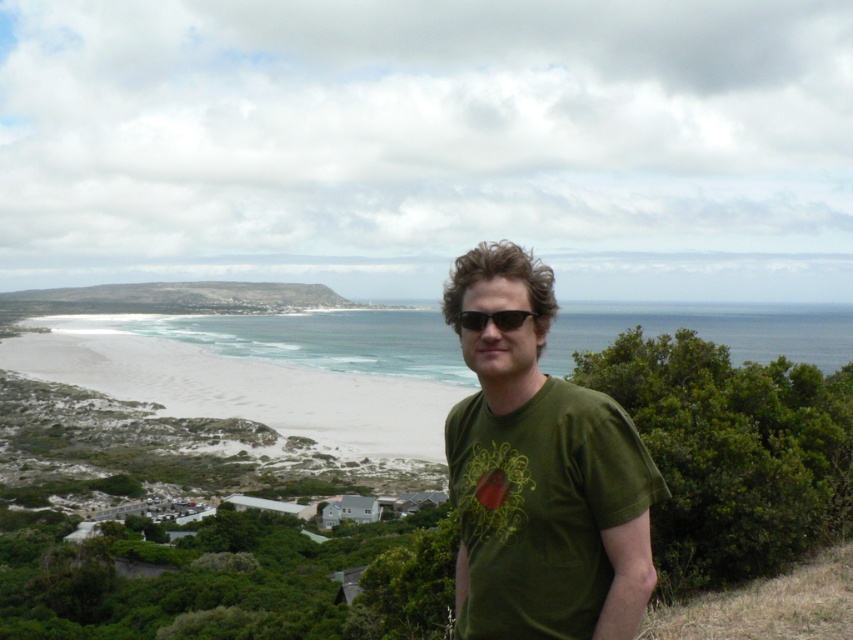
Can you confirm if green matte t-shirt at center is positioned to the left of green grassy hillside at center?

No, green matte t-shirt at center is not to the left of green grassy hillside at center.

Can you confirm if green matte t-shirt at center is wider than green grassy hillside at center?

No, green matte t-shirt at center is not wider than green grassy hillside at center.

Is point (525, 406) positioned in front of point (212, 298)?

Yes, point (525, 406) is in front of point (212, 298).

This screenshot has width=853, height=640. What are the coordinates of `green matte t-shirt at center` in the screenshot? It's located at (540, 474).

Between point (27, 301) and point (497, 320), which one is positioned behind?

The point (27, 301) is more distant.

Looking at this image, can you confirm if green grassy hillside at center is bigger than black plastic sunglasses at center?

Yes.

Which is behind, point (50, 300) or point (526, 314)?

The point (50, 300) is behind.

Find the location of a particular element. green grassy hillside at center is located at coordinates (172, 298).

Does green matte t-shirt at center have a greater width compared to black plastic sunglasses at center?

Correct, the width of green matte t-shirt at center exceeds that of black plastic sunglasses at center.

Does point (491, 385) lie in front of point (469, 316)?

No, it is behind (469, 316).

You are a GUI agent. You are given a task and a screenshot of the screen. Output one action in this format:
    pyautogui.click(x=<x>, y=<y>)
    Task: Click on the green matte t-shirt at center
    This screenshot has width=853, height=640.
    Given the screenshot: What is the action you would take?
    pyautogui.click(x=540, y=474)